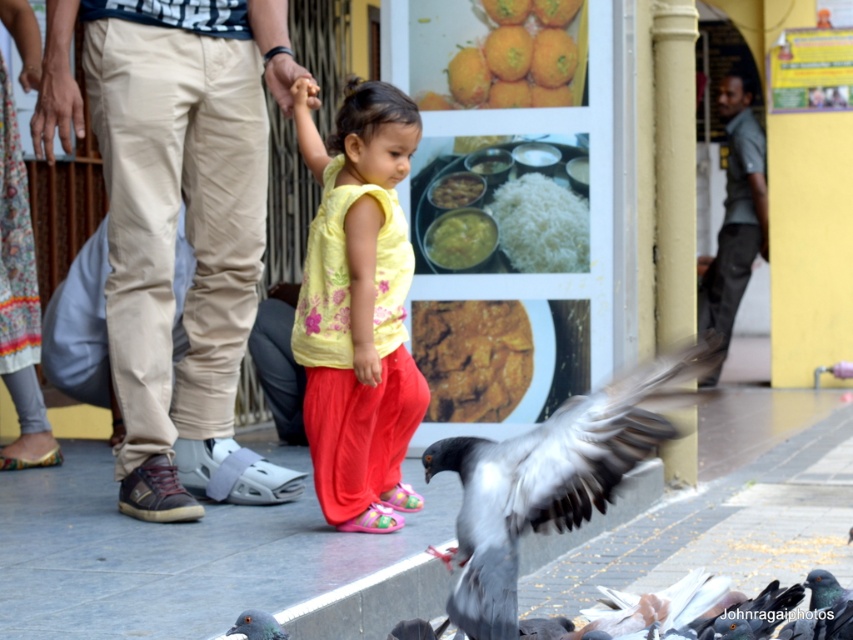
In the scene shown: You are a food delivery robot that needs to deliver a package to a customer. The package must be placed on the tallest item in the scene. Which item should you choose between the brown crumbly bread at center and the green matte curry at center?

The brown crumbly bread at center is taller than the green matte curry at center, so you should place the package on the brown crumbly bread at center.

You are a delivery person who needs to deliver a package to a location 12 meters away. You have a drone that can fly up to 10 meters. Looking at the scene, can the drone reach the white matte rice at center?

The white matte rice at center is 10.65 meters away from the viewer. Since the drone can only fly up to 10 meters, it cannot reach the white matte rice at center as it is beyond its maximum range.

You are a food delivery robot that needs to place both the brown crumbly bread at center and the green matte curry at center on a 30 cm wide tray. Can you fit both items side by side without overlapping?

The brown crumbly bread at center might be wider than green matte curry at center, so there is uncertainty about whether both items can fit side by side on the 30 cm tray. The robot should check the exact widths before placing them.